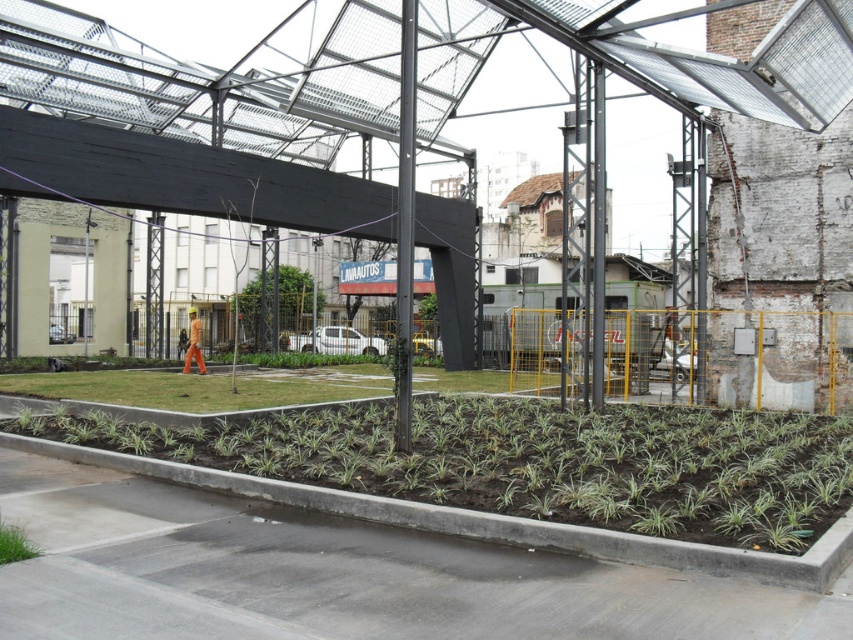
Question: Which of the following is the closest to the observer?

Choices:
 (A) green grass at lower left
 (B) green leafy plants at lower center

Answer: (A)

Question: Is the position of green leafy plants at lower center less distant than that of green grass at lower left?

Choices:
 (A) yes
 (B) no

Answer: (B)

Question: Observing the image, what is the correct spatial positioning of green leafy plants at lower center in reference to green grass at lower left?

Choices:
 (A) above
 (B) below

Answer: (A)

Question: Among these points, which one is nearest to the camera?

Choices:
 (A) (16, 529)
 (B) (267, 458)

Answer: (A)

Question: Which point appears farthest from the camera in this image?

Choices:
 (A) (18, 536)
 (B) (662, 456)

Answer: (B)

Question: Where is green leafy plants at lower center located in relation to green grass at lower left in the image?

Choices:
 (A) above
 (B) below

Answer: (A)